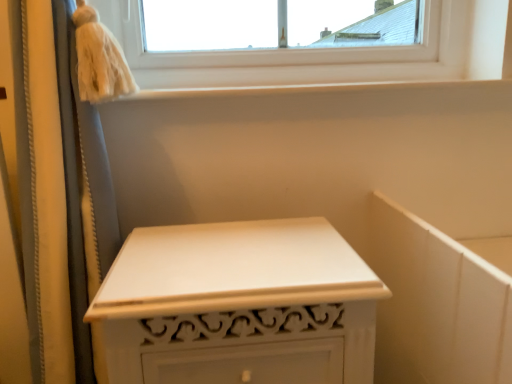
Question: In terms of width, does white smooth window sill at upper center look wider or thinner when compared to white painted wood nightstand at center?

Choices:
 (A) wide
 (B) thin

Answer: (B)

Question: Visually, is white smooth window sill at upper center positioned to the left or to the right of white painted wood nightstand at center?

Choices:
 (A) right
 (B) left

Answer: (A)

Question: Is white smooth window sill at upper center spatially inside white painted wood nightstand at center, or outside of it?

Choices:
 (A) outside
 (B) inside

Answer: (A)

Question: Considering the relative positions of white painted wood nightstand at center and white smooth window sill at upper center in the image provided, is white painted wood nightstand at center to the left or to the right of white smooth window sill at upper center?

Choices:
 (A) left
 (B) right

Answer: (A)

Question: Is white painted wood nightstand at center wider or thinner than white smooth window sill at upper center?

Choices:
 (A) wide
 (B) thin

Answer: (A)

Question: Considering the positions of white painted wood nightstand at center and white smooth window sill at upper center in the image, is white painted wood nightstand at center bigger or smaller than white smooth window sill at upper center?

Choices:
 (A) small
 (B) big

Answer: (B)

Question: From a real-world perspective, relative to white smooth window sill at upper center, is white painted wood nightstand at center vertically above or below?

Choices:
 (A) below
 (B) above

Answer: (A)